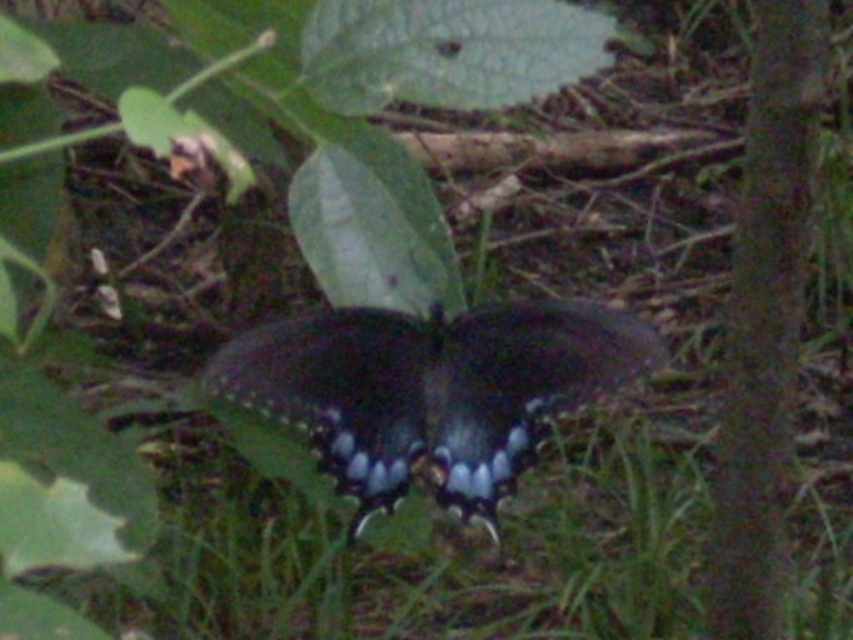
Question: Is green grass at lower center to the right of smooth bark tree at right from the viewer's perspective?

Choices:
 (A) no
 (B) yes

Answer: (A)

Question: Considering the relative positions of green grass at lower center and shiny blue butterfly at center in the image provided, where is green grass at lower center located with respect to shiny blue butterfly at center?

Choices:
 (A) above
 (B) below

Answer: (B)

Question: Is green grass at lower center above shiny blue butterfly at center?

Choices:
 (A) yes
 (B) no

Answer: (B)

Question: Estimate the real-world distances between objects in this image. Which object is farther from the shiny blue butterfly at center?

Choices:
 (A) green grass at lower center
 (B) smooth bark tree at right

Answer: (B)

Question: Which is nearer to the shiny blue butterfly at center?

Choices:
 (A) smooth bark tree at right
 (B) green grass at lower center

Answer: (B)

Question: Which of the following is the farthest from the observer?

Choices:
 (A) pos(728,548)
 (B) pos(283,390)
 (C) pos(190,499)

Answer: (C)